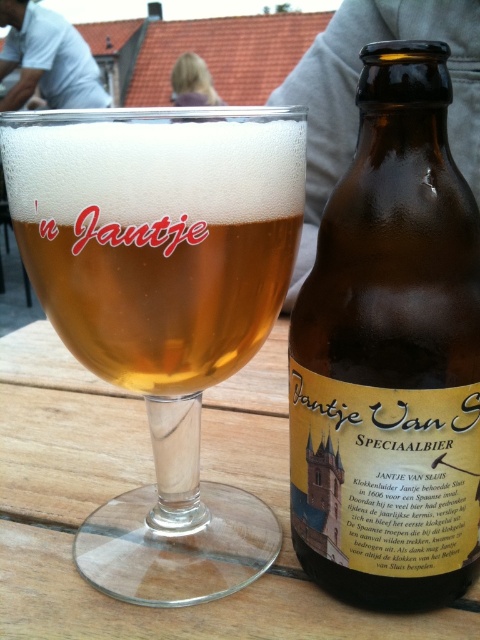
Does clear glass beer glass at center appear over brown glass bottle at center?

Actually, clear glass beer glass at center is below brown glass bottle at center.

Is clear glass beer glass at center wider than brown glass bottle at center?

Indeed, clear glass beer glass at center has a greater width compared to brown glass bottle at center.

Between point (208, 305) and point (384, 314), which one is positioned in front?

Point (384, 314) is in front.

At what (x,y) coordinates should I click in order to perform the action: click on clear glass beer glass at center. Please return your answer as a coordinate pair (x, y). Looking at the image, I should click on (163, 308).